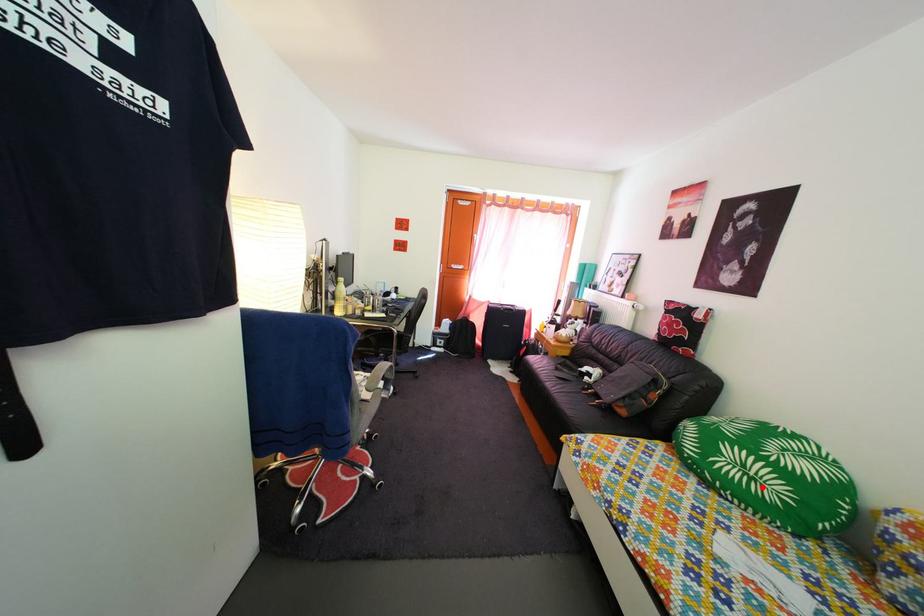
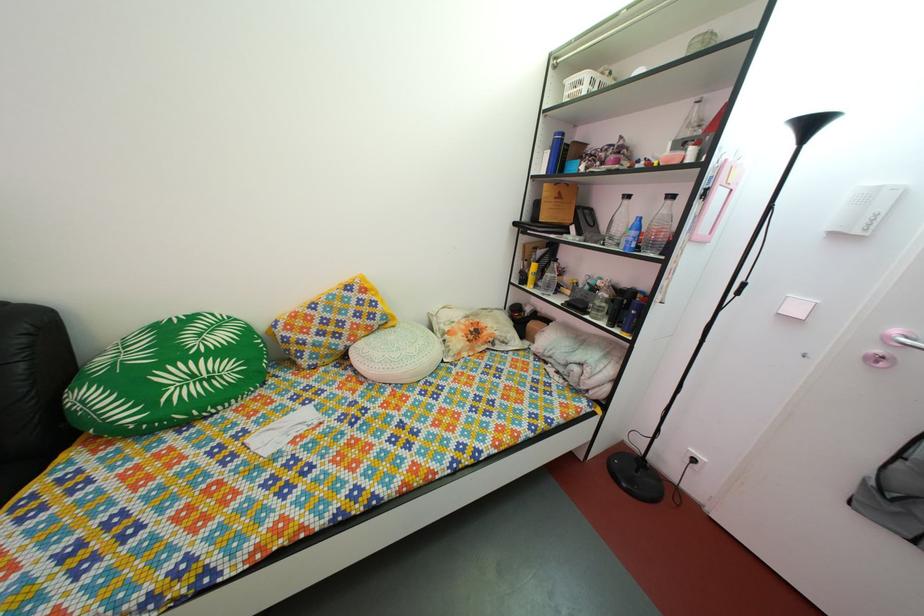
Locate, in the second image, the point that corresponds to the highlighted location in the first image.

(220, 387)